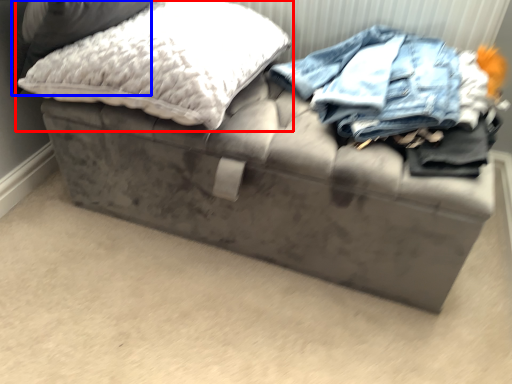
Question: Which object appears closest to the camera in this image, pillow (highlighted by a red box) or pillow (highlighted by a blue box)?

Choices:
 (A) pillow
 (B) pillow

Answer: (B)